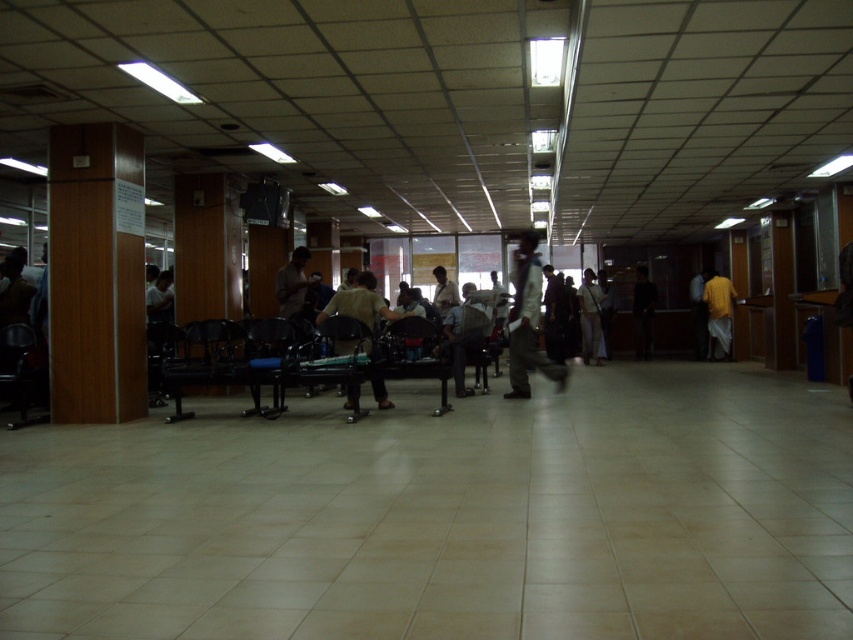
You are standing in the waiting area and want to hand a document to the person wearing the light brown fabric shirt at center and the matte black shirt at center. Which person should you approach first to ensure you reach them without walking past the other?

You should approach the light brown fabric shirt at center first because it is closer to you than the matte black shirt at center, so you won

Based on the photo, you are a maintenance worker in the waiting area. You need to move the light brown leather jacket at center to the lost and found counter located 8 meters away. Can you move it directly without moving any other objects?

The light brown leather jacket at center is 7.64 meters away from the lost and found counter. Since the distance is less than 8 meters, you can move it directly without moving any other objects.